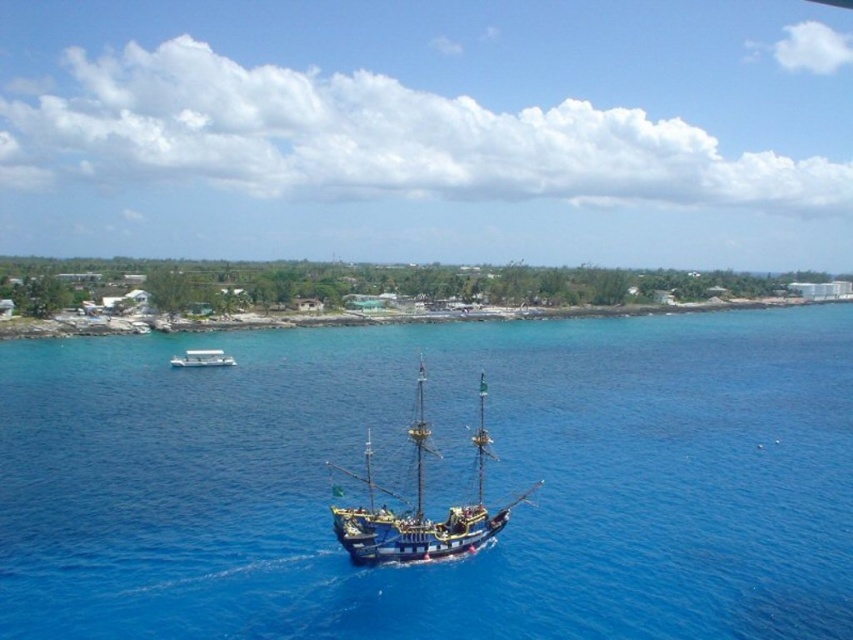
You are standing on the deck of the wooden pirate ship at center. You want to navigate to a specific location marked at point (421, 506). Is the ship already at the target point?

The wooden pirate ship at center is located at point (421, 506), so yes, the ship is already at the target point.

You are standing on the wooden pirate ship at center and want to get to the blue water at center. Which direction should you move in?

The blue water at center is to the right of the wooden pirate ship at center, so you should move to the right to reach it.

You are a sailor trying to decide which vessel to board for a journey. The wooden pirate ship at center and the white plastic boat at lower left are both available. Based on their sizes, which one would you choose if you prefer a larger vessel?

The wooden pirate ship at center is larger in size than the white plastic boat at lower left, so you should choose the wooden pirate ship at center for a larger vessel.